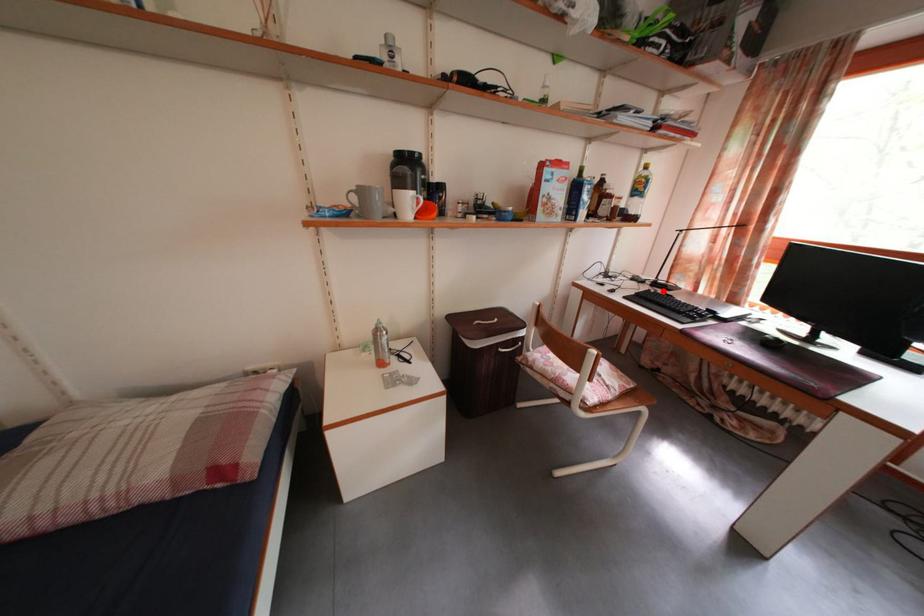
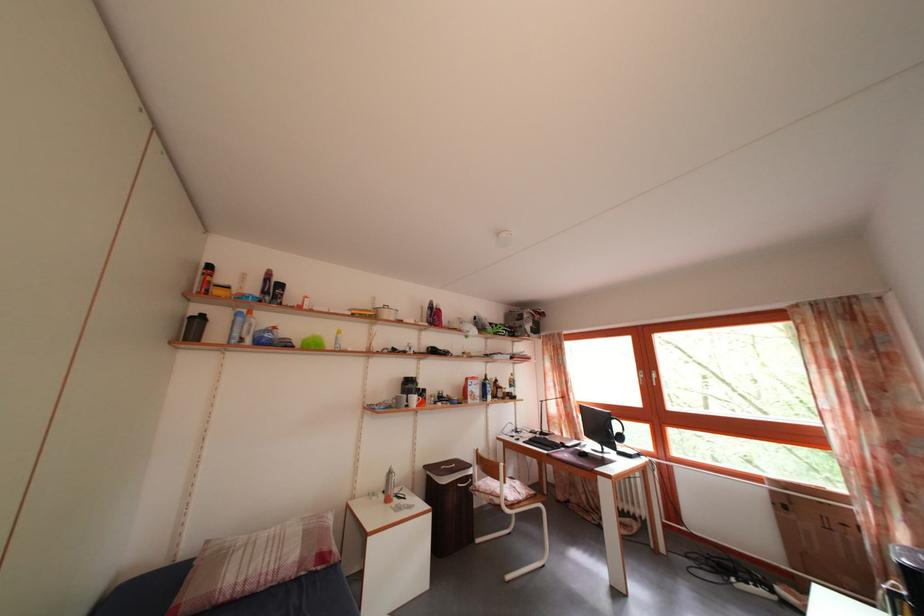
Where in the second image is the point corresponding to the highlighted location from the first image?

(550, 440)